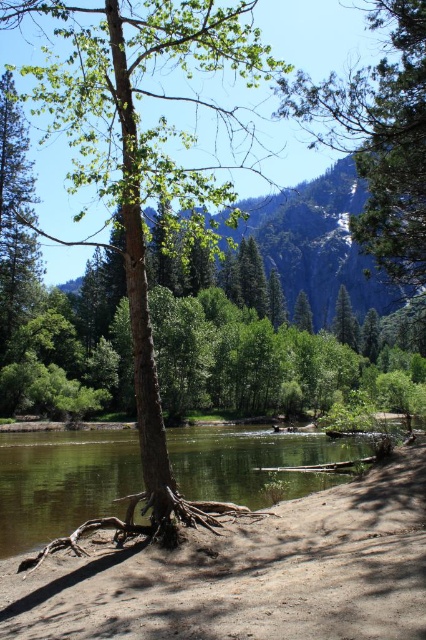
Can you confirm if brown rough bark tree at center is positioned to the left of green textured pine tree at upper right?

Correct, you'll find brown rough bark tree at center to the left of green textured pine tree at upper right.

Is brown rough bark tree at center closer to the viewer compared to green textured pine tree at upper right?

That is True.

The height and width of the screenshot is (640, 426). Find the location of `brown rough bark tree at center`. brown rough bark tree at center is located at coordinates (143, 147).

What do you see at coordinates (379, 138) in the screenshot?
I see `green textured pine tree at upper right` at bounding box center [379, 138].

Is green textured pine tree at upper right to the left of green rough bark tree at upper left from the viewer's perspective?

No, green textured pine tree at upper right is not to the left of green rough bark tree at upper left.

The image size is (426, 640). Identify the location of green textured pine tree at upper right. (379, 138).

Image resolution: width=426 pixels, height=640 pixels. What are the coordinates of `clear water at lower center` in the screenshot? It's located at (62, 483).

Does clear water at lower center lie in front of green rough bark tree at upper left?

Yes, clear water at lower center is in front of green rough bark tree at upper left.

Which is behind, point (11, 497) or point (37, 246)?

The point (37, 246) is more distant.

Locate an element on the screen. clear water at lower center is located at coordinates (62, 483).